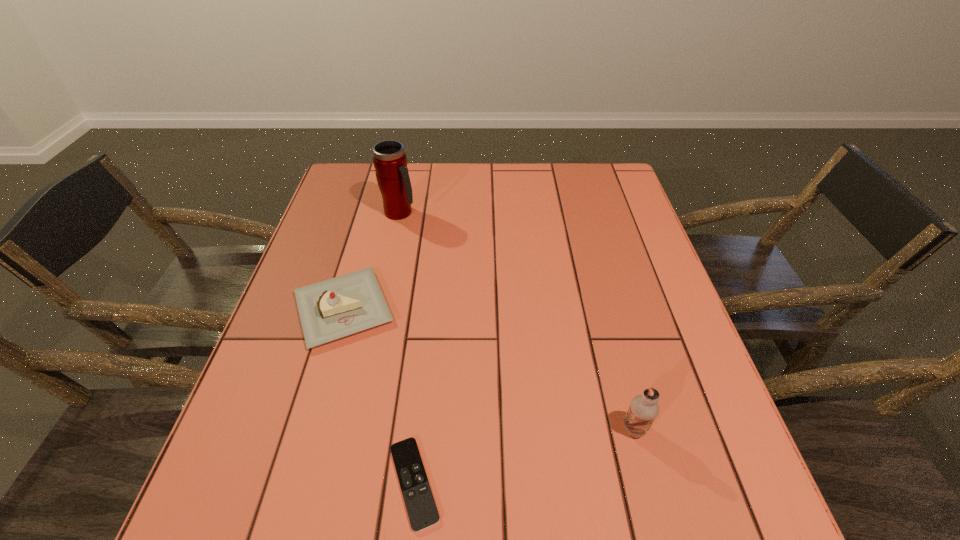
You are a GUI agent. You are given a task and a screenshot of the screen. Output one action in this format:
    pyautogui.click(x=<x>, y=<y>)
    Task: Click on the vacant area at the far right corner
    The width and height of the screenshot is (960, 540).
    Given the screenshot: What is the action you would take?
    pyautogui.click(x=603, y=201)

You are a GUI agent. You are given a task and a screenshot of the screen. Output one action in this format:
    pyautogui.click(x=<x>, y=<y>)
    Task: Click on the free space at the near right corner
    This screenshot has width=960, height=540.
    Given the screenshot: What is the action you would take?
    pyautogui.click(x=757, y=538)

Locate an element on the screen. free space between the farthest object and the cake is located at coordinates (372, 260).

The image size is (960, 540). In order to click on vacant space that's between the farthest object and the chocolate milk in this screenshot , I will do `click(517, 321)`.

Identify the location of free space that is in between the thermos bottle and the shortest object. The image size is (960, 540). (407, 348).

Where is `vacant area that lies between the tallest object and the rightmost object`? vacant area that lies between the tallest object and the rightmost object is located at coordinates (517, 321).

This screenshot has width=960, height=540. I want to click on free spot between the third tallest object and the thermos bottle, so click(372, 260).

In order to click on vacant area that lies between the third tallest object and the third shortest object in this screenshot , I will do `click(489, 368)`.

Find the location of a particular element. This screenshot has width=960, height=540. vacant point located between the thermos bottle and the third nearest object is located at coordinates (372, 260).

You are a GUI agent. You are given a task and a screenshot of the screen. Output one action in this format:
    pyautogui.click(x=<x>, y=<y>)
    Task: Click on the vacant space that is in between the thermos bottle and the second shortest object
    
    Given the screenshot: What is the action you would take?
    pyautogui.click(x=372, y=260)